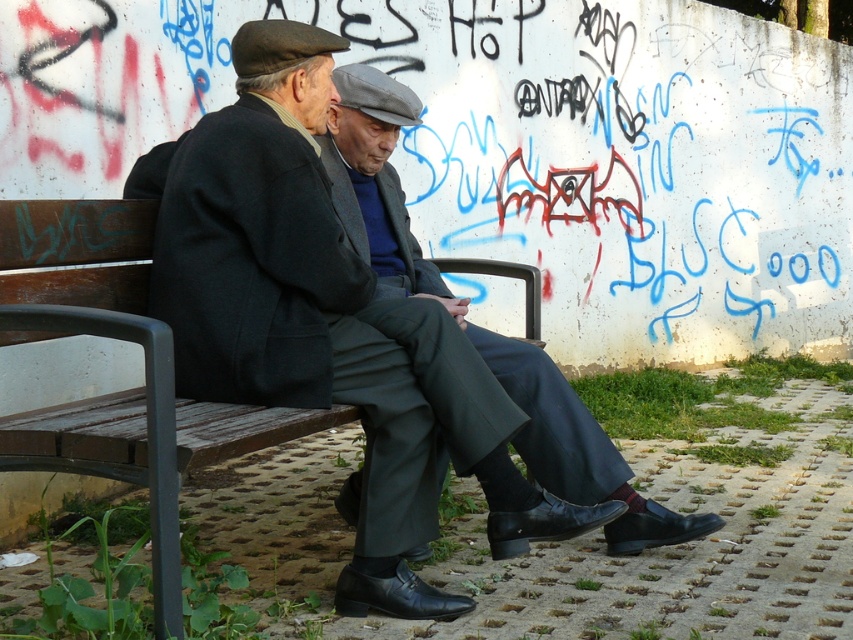
You are standing in front of the graffiti wall and see two points marked on it. Which point is closer to you, the point at coordinate (x=189, y=428) or the point at (x=355, y=486)?

The point at coordinate (x=189, y=428) is closer to the viewer than the point at (x=355, y=486).

You are a tailor measuring for a custom suit. You observe the matte black suit at center and the wooden bench at center in the image. Can the suit be placed on the bench without overlapping its edges?

The matte black suit at center and wooden bench at center are 10.04 inches apart, so the suit can be placed on the bench without overlapping its edges since the distance between them suggests sufficient space.